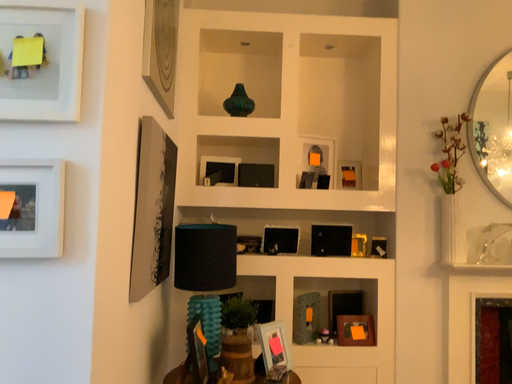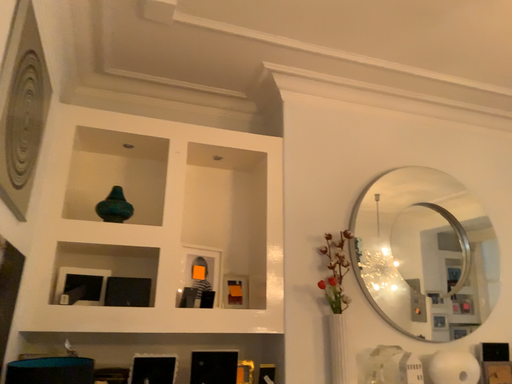
Question: How did the camera likely rotate when shooting the video?

Choices:
 (A) rotated right
 (B) rotated left

Answer: (A)